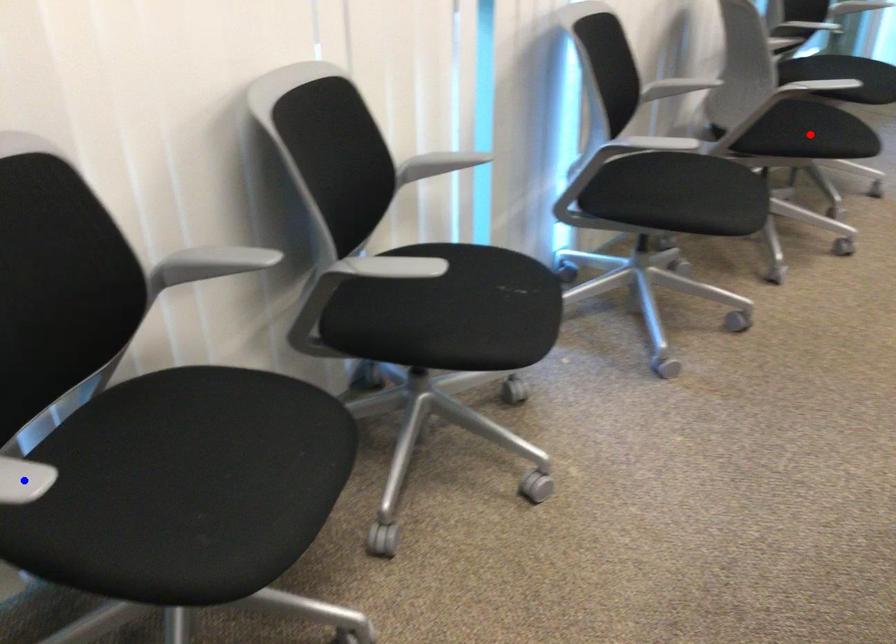
Question: In the image, two points are highlighted. Which point is nearer to the camera? Reply with the corresponding letter.

Choices:
 (A) blue point
 (B) red point

Answer: (A)